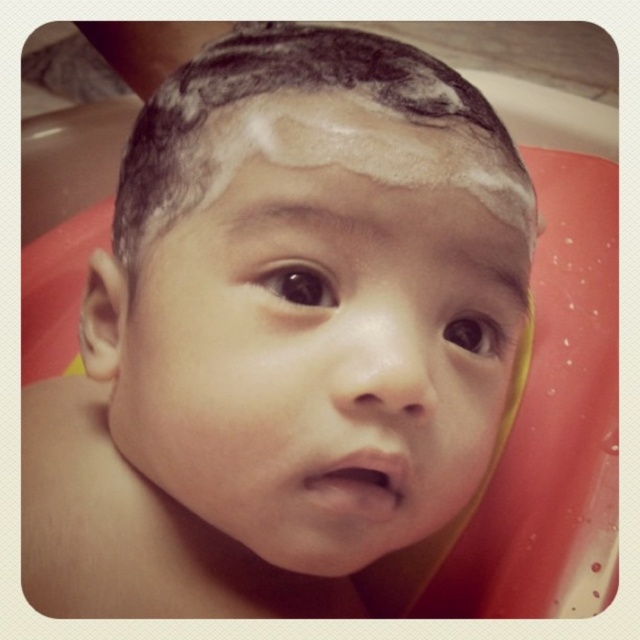
Question: Among these objects, which one is nearest to the camera?

Choices:
 (A) smooth skin baby at center
 (B) wet dark brown hair at center

Answer: (A)

Question: Can you confirm if smooth skin baby at center is smaller than wet dark brown hair at center?

Choices:
 (A) no
 (B) yes

Answer: (A)

Question: Which of the following is the farthest from the observer?

Choices:
 (A) [x=268, y=360]
 (B) [x=330, y=42]

Answer: (B)

Question: Can you confirm if smooth skin baby at center is positioned to the left of wet dark brown hair at center?

Choices:
 (A) yes
 (B) no

Answer: (A)

Question: Is smooth skin baby at center positioned in front of wet dark brown hair at center?

Choices:
 (A) no
 (B) yes

Answer: (B)

Question: Which of the following is the farthest from the observer?

Choices:
 (A) (330, 502)
 (B) (412, 106)

Answer: (B)